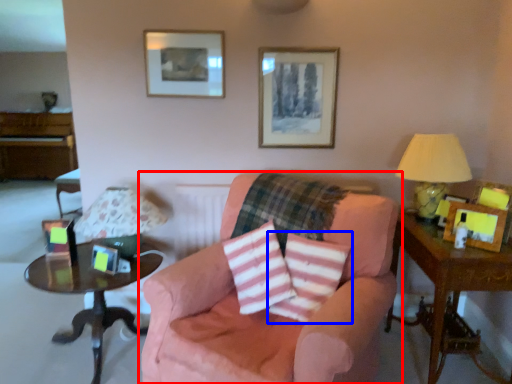
Question: Which point is further to the camera, chair (highlighted by a red box) or throw pillow (highlighted by a blue box)?

Choices:
 (A) chair
 (B) throw pillow

Answer: (B)